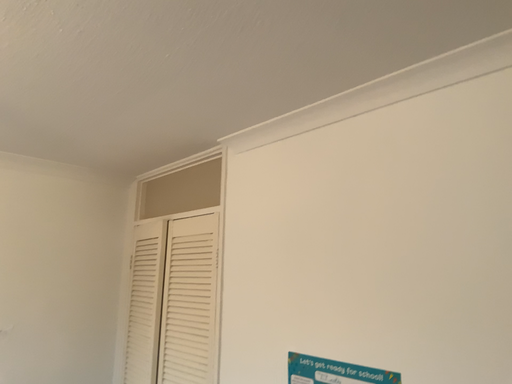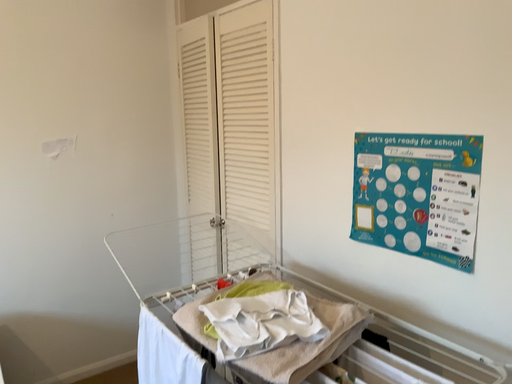
Question: How did the camera likely rotate when shooting the video?

Choices:
 (A) rotated downward
 (B) rotated upward

Answer: (A)